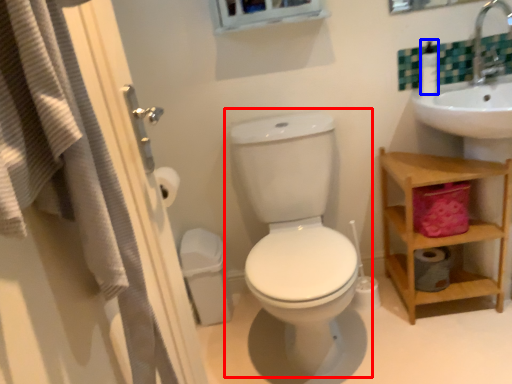
Question: Which object appears closest to the camera in this image, toilet (highlighted by a red box) or soap dispenser (highlighted by a blue box)?

Choices:
 (A) toilet
 (B) soap dispenser

Answer: (A)